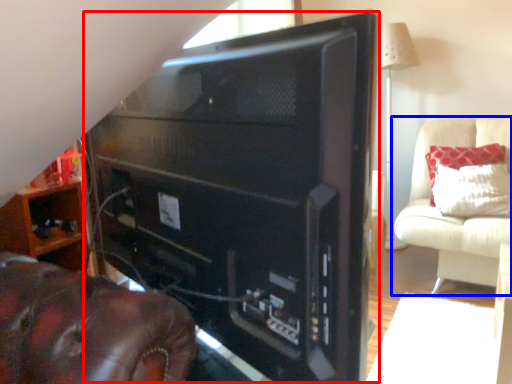
Question: Which object is closer to the camera taking this photo, desktop computer (highlighted by a red box) or furniture (highlighted by a blue box)?

Choices:
 (A) desktop computer
 (B) furniture

Answer: (A)